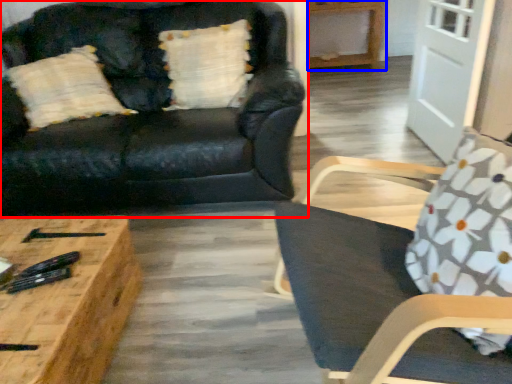
Question: Which point is further to the camera, studio couch (highlighted by a red box) or hardwood (highlighted by a blue box)?

Choices:
 (A) studio couch
 (B) hardwood

Answer: (B)